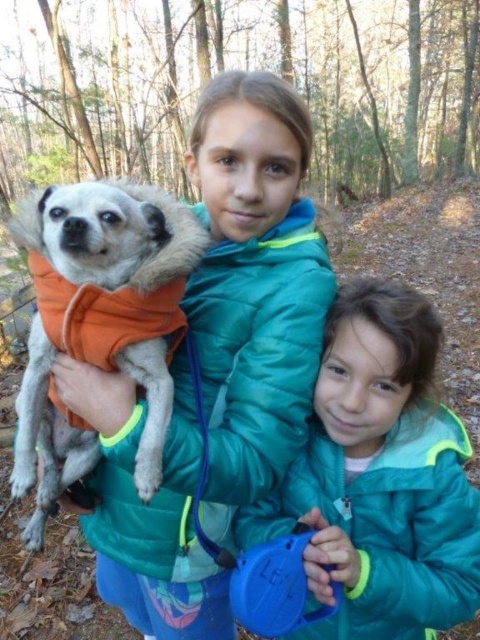
Question: Which point is closer to the camera taking this photo?

Choices:
 (A) (106, 273)
 (B) (340, 525)
 (C) (259, 188)

Answer: (A)

Question: Which point is closer to the camera?

Choices:
 (A) teal puffer jacket at lower right
 (B) orange fleece vest at left
 (C) orange fleece dog at left

Answer: (B)

Question: Does orange fleece dog at left come in front of teal puffer jacket at lower right?

Choices:
 (A) no
 (B) yes

Answer: (A)

Question: Which object is positioned farthest from the orange fleece dog at left?

Choices:
 (A) orange fleece vest at left
 (B) teal puffer jacket at lower right

Answer: (B)

Question: Can you confirm if orange fleece dog at left is bigger than orange fleece vest at left?

Choices:
 (A) no
 (B) yes

Answer: (B)

Question: Can you confirm if orange fleece dog at left is positioned above orange fleece vest at left?

Choices:
 (A) no
 (B) yes

Answer: (A)